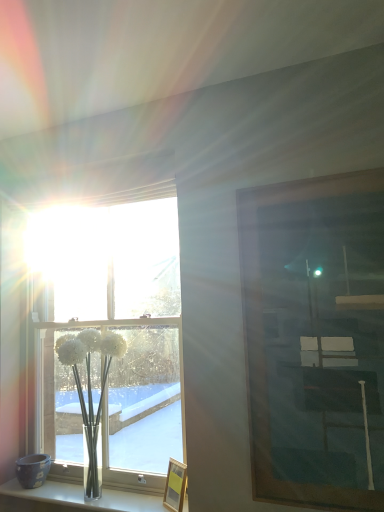
Where is `clear glass window at center`? clear glass window at center is located at coordinates (113, 329).

What do you see at coordinates (113, 329) in the screenshot? The height and width of the screenshot is (512, 384). I see `clear glass window at center` at bounding box center [113, 329].

Describe the element at coordinates (175, 485) in the screenshot. I see `wooden picture frame at lower center, which is the second picture frame in right-to-left order` at that location.

Describe the element at coordinates (90, 393) in the screenshot. I see `white glass vase at lower left` at that location.

Where is `clear glass window at center`? The width and height of the screenshot is (384, 512). clear glass window at center is located at coordinates (113, 329).

Is point (182, 507) more distant than point (337, 462)?

Yes, point (182, 507) is farther from viewer.

Could you tell me if wooden picture frame at lower center, which appears as the first picture frame when ordered from the bottom, is turned towards wooden picture frame at right, the 1th picture frame viewed from the top?

No, wooden picture frame at lower center, which appears as the first picture frame when ordered from the bottom, is not facing towards wooden picture frame at right, the 1th picture frame viewed from the top.

This screenshot has width=384, height=512. What are the coordinates of `picture frame located above the wooden picture frame at lower center, the 2th picture frame viewed from the front (from a real-world perspective)` in the screenshot? It's located at (315, 339).

Which is in front, wooden picture frame at lower center, which appears as the first picture frame when ordered from the bottom, or wooden picture frame at right, placed as the second picture frame when sorted from back to front?

Positioned in front is wooden picture frame at right, placed as the second picture frame when sorted from back to front.

Considering the positions of objects clear glass vase at lower left and clear glass window at center in the image provided, who is in front, clear glass vase at lower left or clear glass window at center?

clear glass vase at lower left is more forward.

From a real-world perspective, which object rests below the other?

clear glass vase at lower left is physically lower.

Which is closer to the camera, (41,502) or (176,383)?

The point (41,502) is closer.

Considering the positions of objects clear glass vase at lower left and clear glass window at center in the image provided, who is more to the left, clear glass vase at lower left or clear glass window at center?

clear glass vase at lower left.

Can you confirm if clear glass window at center is shorter than clear glass vase at lower left?

In fact, clear glass window at center may be taller than clear glass vase at lower left.

Looking at this image, which object is further away from the camera taking this photo, clear glass window at center or clear glass vase at lower left?

clear glass window at center is further from the camera.

In the scene shown: Do you think clear glass window at center is within clear glass vase at lower left, or outside of it?

clear glass window at center is not inside clear glass vase at lower left, it's outside.

From the picture: Does clear glass window at center have a larger size compared to clear glass vase at lower left?

Yes.

Is clear glass window at center spatially inside wooden picture frame at right, placed as the second picture frame when sorted from back to front, or outside of it?

clear glass window at center cannot be found inside wooden picture frame at right, placed as the second picture frame when sorted from back to front.

Considering the positions of objects clear glass window at center and wooden picture frame at right, the 1th picture frame viewed from the top, in the image provided, who is more to the right, clear glass window at center or wooden picture frame at right, the 1th picture frame viewed from the top,?

wooden picture frame at right, the 1th picture frame viewed from the top, is more to the right.

Is clear glass window at center placed right next to wooden picture frame at right, the 1th picture frame viewed from the top?

They are not placed beside each other.

Which is more to the right, clear glass window at center or white glass vase at lower left?

white glass vase at lower left.

How much distance is there between clear glass window at center and white glass vase at lower left?

clear glass window at center and white glass vase at lower left are 13.64 inches apart.

Can you tell me how much clear glass window at center and white glass vase at lower left differ in facing direction?

The angular difference between clear glass window at center and white glass vase at lower left is 1.64 degrees.

Is clear glass window at center turned away from white glass vase at lower left?

Correct, clear glass window at center is looking away from white glass vase at lower left.

In the image, there is a wooden picture frame at right, acting as the first picture frame starting from the front. At what (x,y) coordinates should I click in order to perform the action: click on window below it (from the image's perspective). Please return your answer as a coordinate pair (x, y). Looking at the image, I should click on (113, 329).

Does wooden picture frame at right, which ranks as the second picture frame in bottom-to-top order, have a greater height compared to clear glass window at center?

No, wooden picture frame at right, which ranks as the second picture frame in bottom-to-top order, is not taller than clear glass window at center.

Is wooden picture frame at right, the first picture frame in the right-to-left sequence, in front of or behind clear glass window at center in the image?

Visually, wooden picture frame at right, the first picture frame in the right-to-left sequence, is located in front of clear glass window at center.

Do you think wooden picture frame at right, the 2th picture frame in the left-to-right sequence, is within clear glass window at center, or outside of it?

wooden picture frame at right, the 2th picture frame in the left-to-right sequence, is spatially situated outside clear glass window at center.

Does wooden picture frame at lower center, the 2th picture frame viewed from the front, have a lesser width compared to clear glass window at center?

Correct, the width of wooden picture frame at lower center, the 2th picture frame viewed from the front, is less than that of clear glass window at center.

In the scene shown: Would you say clear glass window at center is part of wooden picture frame at lower center, the 2th picture frame viewed from the front,'s contents?

No, clear glass window at center is not inside wooden picture frame at lower center, the 2th picture frame viewed from the front.

Based on their positions, is wooden picture frame at lower center, which is the 2th picture frame in top-to-bottom order, located to the left or right of clear glass window at center?

wooden picture frame at lower center, which is the 2th picture frame in top-to-bottom order, is to the right of clear glass window at center.

Could you tell me if wooden picture frame at lower center, placed as the 1th picture frame when sorted from back to front, is turned towards clear glass window at center?

No, wooden picture frame at lower center, placed as the 1th picture frame when sorted from back to front, is not turned towards clear glass window at center.

I want to click on picture frame that is behind the wooden picture frame at right, the 1th picture frame viewed from the top, so click(175, 485).

I want to click on shelf located underneath the clear glass window at center (from a real-world perspective), so click(73, 499).

Estimate the real-world distances between objects in this image. Which object is further from wooden picture frame at right, which ranks as the second picture frame in bottom-to-top order, clear glass vase at lower left or clear glass window at center?

Based on the image, clear glass vase at lower left appears to be further to wooden picture frame at right, which ranks as the second picture frame in bottom-to-top order.

When comparing their distances from white glass vase at lower left, does wooden picture frame at lower center, which is the second picture frame in right-to-left order, or clear glass vase at lower left seem further?

The object further to white glass vase at lower left is wooden picture frame at lower center, which is the second picture frame in right-to-left order.

Which object lies further to the anchor point white glass vase at lower left, clear glass window at center or wooden picture frame at right, placed as the second picture frame when sorted from back to front?

Based on the image, wooden picture frame at right, placed as the second picture frame when sorted from back to front, appears to be further to white glass vase at lower left.

Based on their spatial positions, is wooden picture frame at lower center, the first picture frame when ordered from left to right, or clear glass vase at lower left further from clear glass window at center?

Among the two, wooden picture frame at lower center, the first picture frame when ordered from left to right, is located further to clear glass window at center.

Looking at the image, which one is located closer to clear glass window at center, clear glass vase at lower left or wooden picture frame at right, which ranks as the second picture frame in bottom-to-top order?

clear glass vase at lower left is positioned closer to the anchor clear glass window at center.

Which object lies nearer to the anchor point wooden picture frame at lower center, which is the 2th picture frame in top-to-bottom order, white glass vase at lower left or wooden picture frame at right, acting as the first picture frame starting from the front?

Among the two, white glass vase at lower left is located nearer to wooden picture frame at lower center, which is the 2th picture frame in top-to-bottom order.

When comparing their distances from wooden picture frame at right, the 1th picture frame viewed from the top, does wooden picture frame at lower center, the 2th picture frame viewed from the front, or clear glass window at center seem closer?

Based on the image, wooden picture frame at lower center, the 2th picture frame viewed from the front, appears to be nearer to wooden picture frame at right, the 1th picture frame viewed from the top.

Looking at the image, which one is located closer to clear glass window at center, white glass vase at lower left or wooden picture frame at right, acting as the first picture frame starting from the front?

The object closer to clear glass window at center is white glass vase at lower left.

Locate an element on the screen. floral arrangement between clear glass window at center and clear glass vase at lower left in the up-down direction is located at coordinates (90, 393).

Where is `floral arrangement between clear glass vase at lower left and wooden picture frame at right, the 2th picture frame in the left-to-right sequence, from left to right`? The height and width of the screenshot is (512, 384). floral arrangement between clear glass vase at lower left and wooden picture frame at right, the 2th picture frame in the left-to-right sequence, from left to right is located at coordinates (90, 393).

The image size is (384, 512). Identify the location of picture frame between clear glass window at center and clear glass vase at lower left in the up-down direction. (175, 485).

Image resolution: width=384 pixels, height=512 pixels. In order to click on floral arrangement between clear glass window at center and wooden picture frame at lower center, the first picture frame when ordered from left to right, in the vertical direction in this screenshot , I will do `click(90, 393)`.